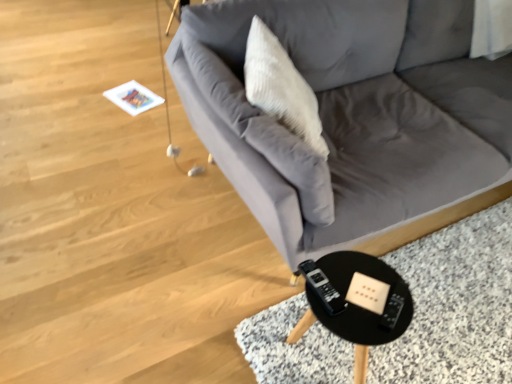
Question: In terms of height, does gray fabric couch at center look taller or shorter compared to white textured pillow at upper center?

Choices:
 (A) tall
 (B) short

Answer: (A)

Question: In the image, is gray fabric couch at center positioned in front of or behind white textured pillow at upper center?

Choices:
 (A) front
 (B) behind

Answer: (A)

Question: Which object is positioned farthest from the white textured pillow at upper center?

Choices:
 (A) black plastic table at lower right
 (B) gray fabric couch at center

Answer: (A)

Question: Which is farther from the black plastic table at lower right?

Choices:
 (A) white textured pillow at upper center
 (B) gray fabric couch at center

Answer: (B)